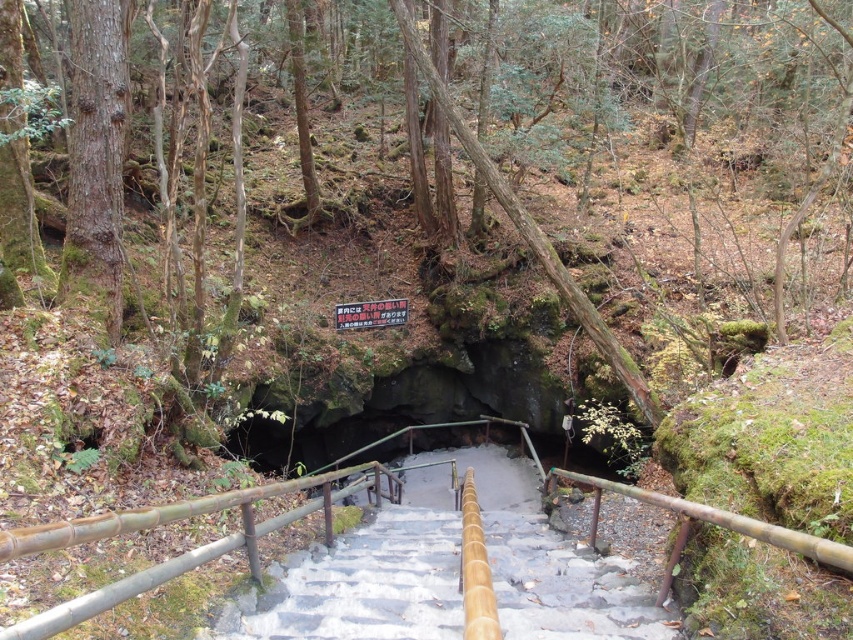
Question: In this image, where is bamboo/rustic wood railing at center located relative to black plastic sign at center?

Choices:
 (A) above
 (B) below

Answer: (B)

Question: Which point is farther to the camera?

Choices:
 (A) black plastic sign at center
 (B) bamboo/rustic wood railing at center

Answer: (A)

Question: Is green mossy rock at center above black plastic sign at center?

Choices:
 (A) no
 (B) yes

Answer: (B)

Question: Can you confirm if green mossy rock at center is positioned to the left of black plastic sign at center?

Choices:
 (A) no
 (B) yes

Answer: (B)

Question: Which point appears closest to the camera in this image?

Choices:
 (A) (375, 314)
 (B) (94, 602)

Answer: (B)

Question: Which of these objects is positioned farthest from the green mossy rock at center?

Choices:
 (A) bamboo/rustic wood railing at center
 (B) black plastic sign at center

Answer: (A)